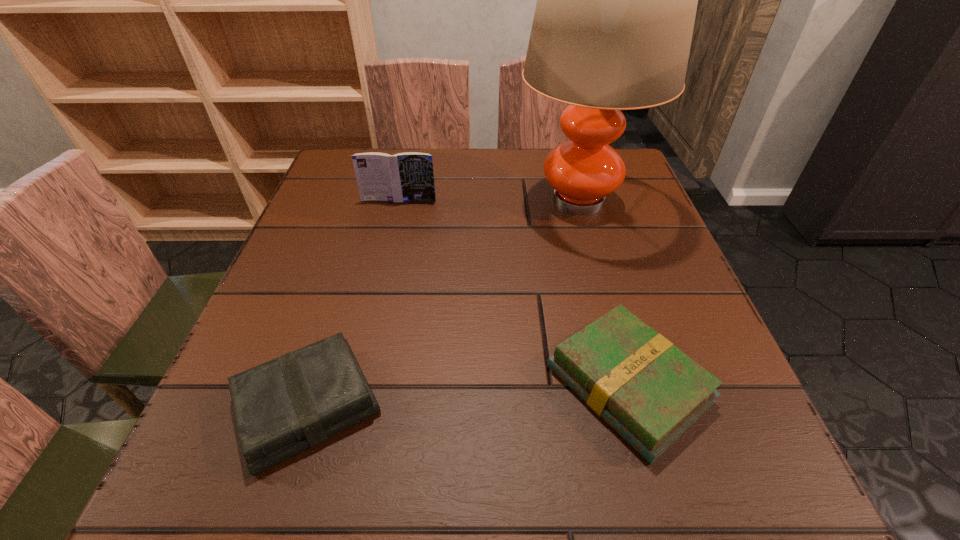
What are the coordinates of `vacant space that satisfies the following two spatial constraints: 1. on the front cover of the rightmost book; 2. on the left side of the second tallest object` in the screenshot? It's located at [x=356, y=384].

The height and width of the screenshot is (540, 960). Find the location of `vacant position in the image that satisfies the following two spatial constraints: 1. on the front cover of the rightmost book; 2. on the left side of the tallest book`. vacant position in the image that satisfies the following two spatial constraints: 1. on the front cover of the rightmost book; 2. on the left side of the tallest book is located at coordinates (356, 384).